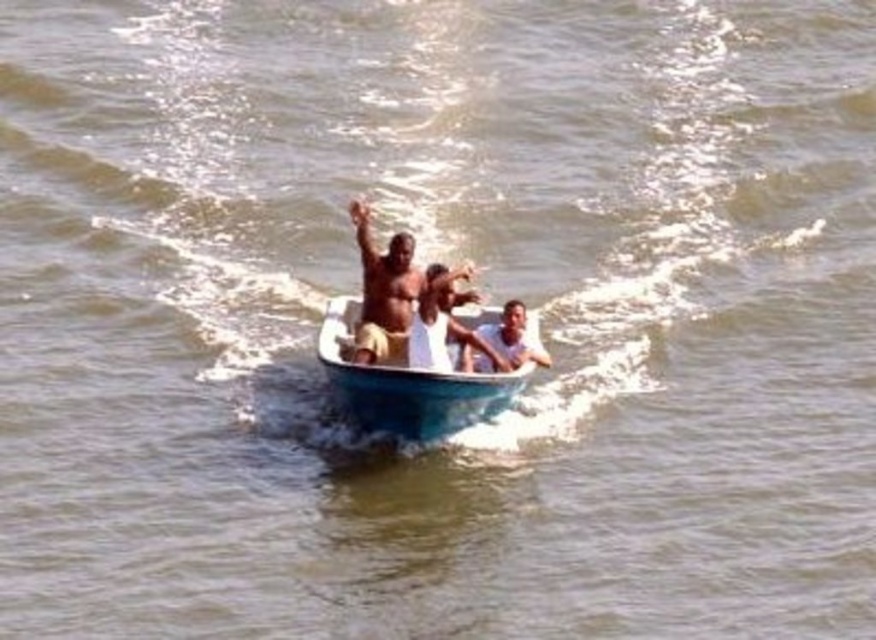
Question: Is light brown skin at center below smooth skin man at center?

Choices:
 (A) yes
 (B) no

Answer: (B)

Question: Is light brown skin at center below smooth skin man at center?

Choices:
 (A) no
 (B) yes

Answer: (A)

Question: In this image, where is white plastic boat at center located relative to light brown skin at center?

Choices:
 (A) below
 (B) above

Answer: (A)

Question: Among these points, which one is farthest from the camera?

Choices:
 (A) (436, 432)
 (B) (546, 365)
 (C) (378, 310)

Answer: (B)

Question: Which object is positioned farthest from the smooth skin man at center?

Choices:
 (A) white plastic boat at center
 (B) light brown skin at center

Answer: (B)

Question: Among these points, which one is nearest to the camera?

Choices:
 (A) (352, 212)
 (B) (373, 419)

Answer: (B)